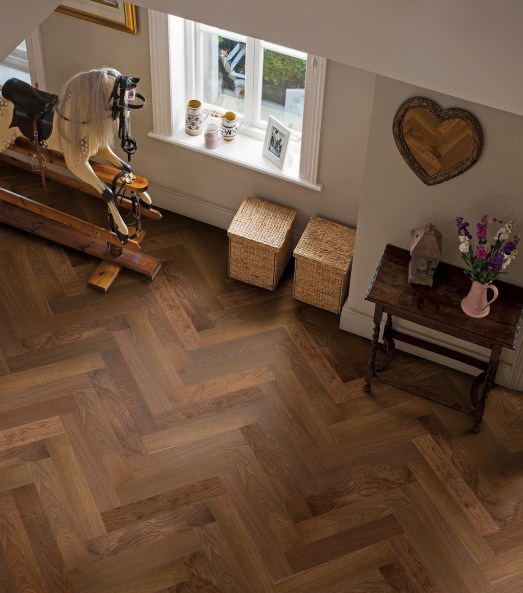
Locate an element on the screen. The height and width of the screenshot is (593, 523). decorative blue and white jar is located at coordinates (192, 124).